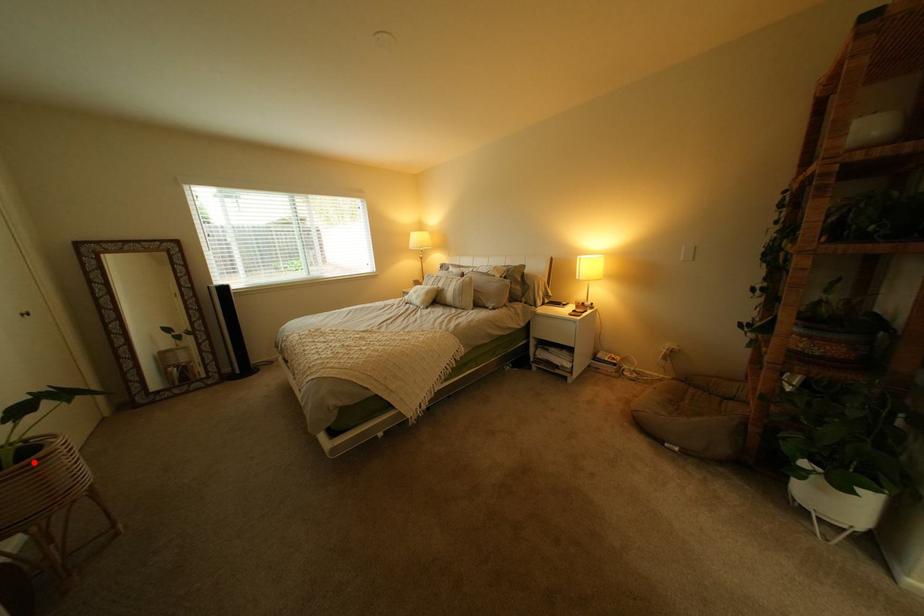
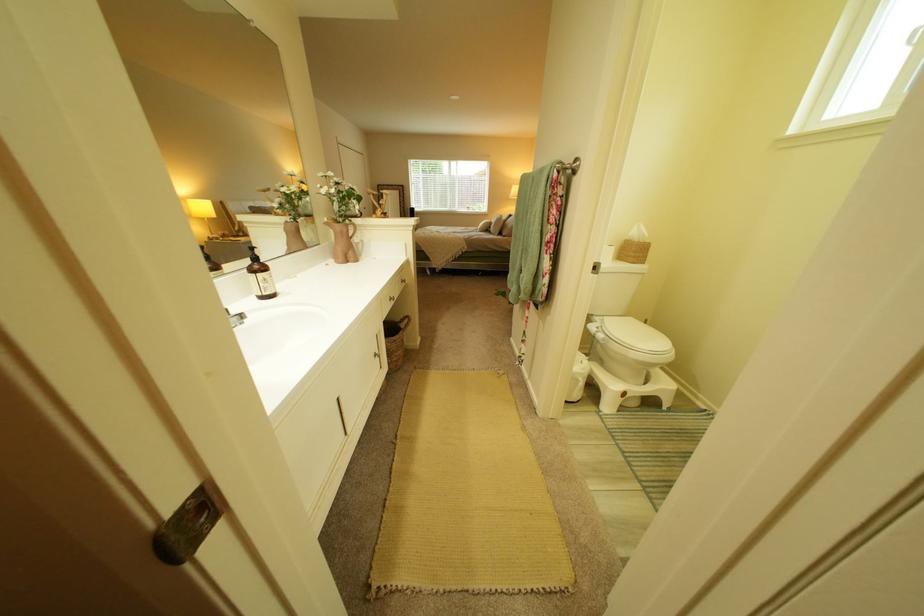
Question: I am providing you with two images of the same scene from different viewpoints. A red point is marked on the first image. Is the red point's position out of view in image 2?

Choices:
 (A) Yes
 (B) No

Answer: (A)